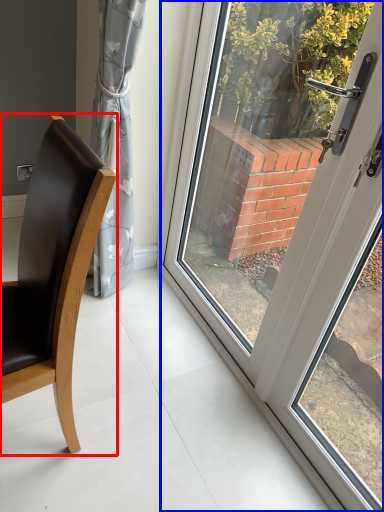
Question: Which of the following is the closest to the observer, chair (highlighted by a red box) or door (highlighted by a blue box)?

Choices:
 (A) chair
 (B) door

Answer: (B)